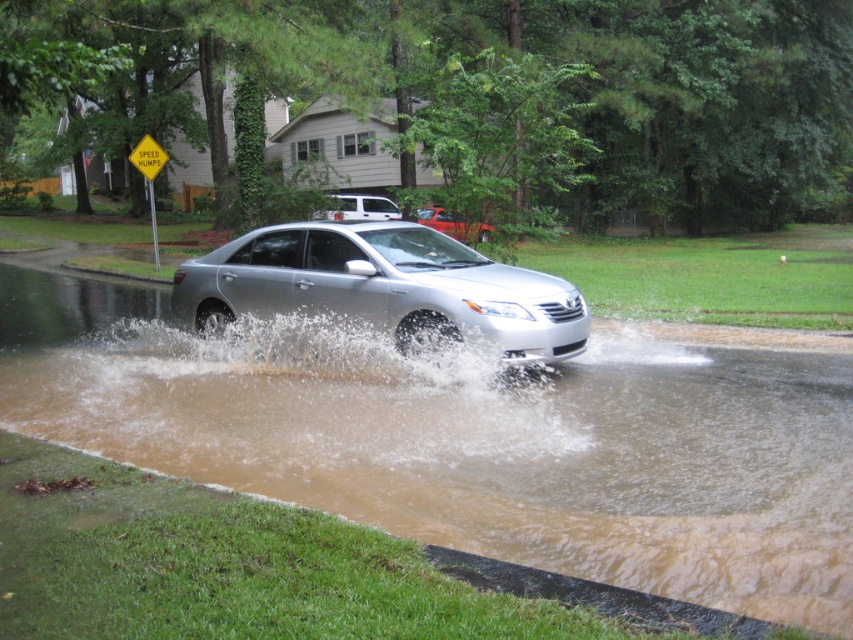
You are a pedestrian standing on the sidewalk and see both the silver metallic sedan at center and the white matte van at center. Which vehicle is closer to the ground?

The silver metallic sedan at center has a lesser height compared to the white matte van at center, so it is closer to the ground.

You are a delivery driver navigating through the flooded street. Your GPS shows the nearest safe parking spot is located at coordinate point 0.452, 0.450. Is the silver metallic sedan at center currently blocking your path to the parking spot?

The silver metallic sedan at center is exactly at the coordinate point (383, 289), so it is currently blocking your path to the parking spot.